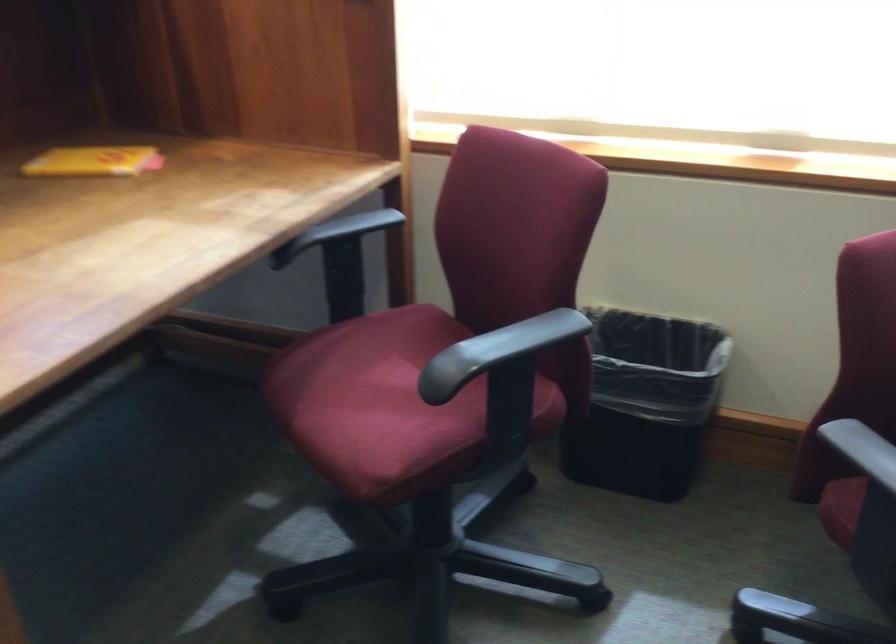
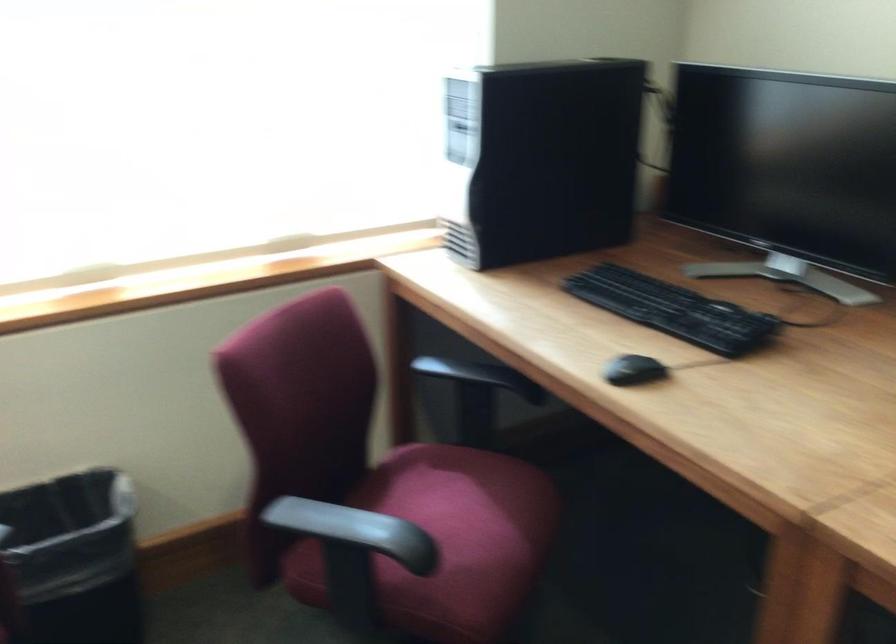
Question: The camera is either moving clockwise (left) or counter-clockwise (right) around the object. The first image is from the beginning of the video and the second image is from the end. Is the camera moving left or right when shooting the video?

Choices:
 (A) Left
 (B) Right

Answer: (A)